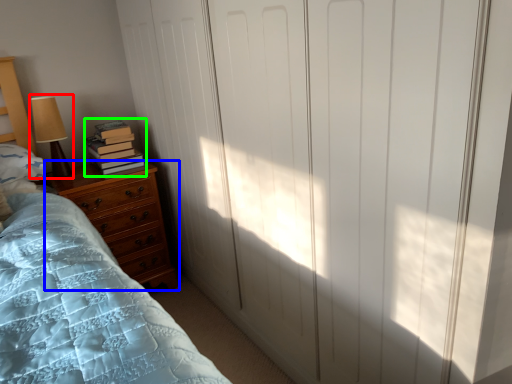
Question: Estimate the real-world distances between objects in this image. Which object is farther from table lamp (highlighted by a red box), chest of drawers (highlighted by a blue box) or book (highlighted by a green box)?

Choices:
 (A) chest of drawers
 (B) book

Answer: (A)